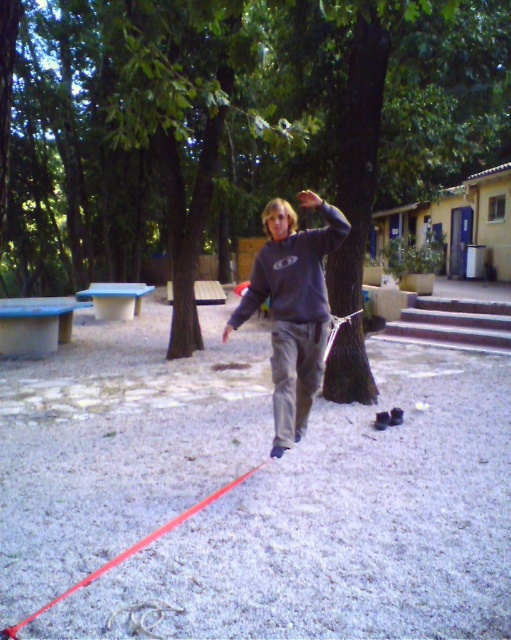
Question: Does green leafy tree at center have a greater width compared to matte gray sweatshirt at center?

Choices:
 (A) yes
 (B) no

Answer: (A)

Question: Observing the image, what is the correct spatial positioning of dark gray sweatshirt at center in reference to matte gray sweatshirt at center?

Choices:
 (A) left
 (B) right

Answer: (B)

Question: Which object is positioned farthest from the green leafy tree at center?

Choices:
 (A) dark gray sweatshirt at center
 (B) matte gray sweatshirt at center

Answer: (A)

Question: Does green leafy tree at center appear on the left side of dark gray sweatshirt at center?

Choices:
 (A) yes
 (B) no

Answer: (A)

Question: Among these points, which one is nearest to the camera?

Choices:
 (A) (256, 307)
 (B) (150, 257)
 (C) (263, 268)

Answer: (C)

Question: Which object appears closest to the camera in this image?

Choices:
 (A) green leafy tree at center
 (B) matte gray sweatshirt at center

Answer: (A)